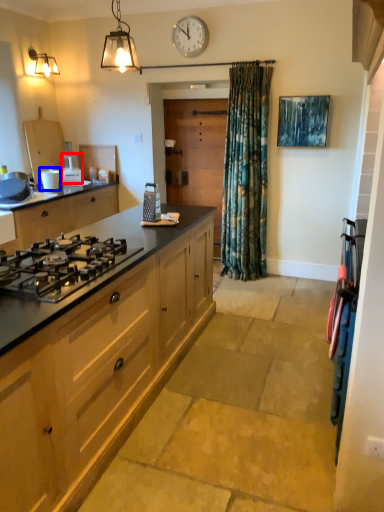
Question: Which point is further to the camera, appliance (highlighted by a red box) or appliance (highlighted by a blue box)?

Choices:
 (A) appliance
 (B) appliance

Answer: (A)